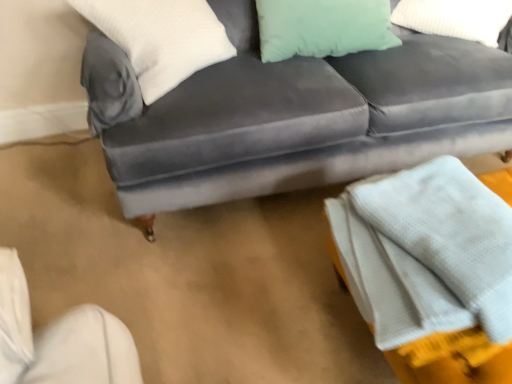
Question: Would you say mint green fabric pillow at upper right, arranged as the 1th pillow when viewed from the right, is to the left or to the right of white soft pillow at upper left, which is the 1th pillow from left to right, in the picture?

Choices:
 (A) right
 (B) left

Answer: (A)

Question: Considering the positions of mint green fabric pillow at upper right, arranged as the 1th pillow when viewed from the right, and white soft pillow at upper left, which is the 1th pillow from left to right, in the image, is mint green fabric pillow at upper right, arranged as the 1th pillow when viewed from the right, bigger or smaller than white soft pillow at upper left, which is the 1th pillow from left to right,?

Choices:
 (A) small
 (B) big

Answer: (A)

Question: Which is nearer to the mint green fabric pillow at upper right, positioned as the 2th pillow in left-to-right order?

Choices:
 (A) velvet gray couch at center
 (B) white textured blanket at lower right
 (C) white soft pillow at upper left, which is the 1th pillow from left to right

Answer: (A)

Question: Which is nearer to the white soft pillow at upper left, which is the 1th pillow from left to right?

Choices:
 (A) white textured blanket at lower right
 (B) velvet gray couch at center
 (C) mint green fabric pillow at upper right, positioned as the 2th pillow in left-to-right order

Answer: (B)